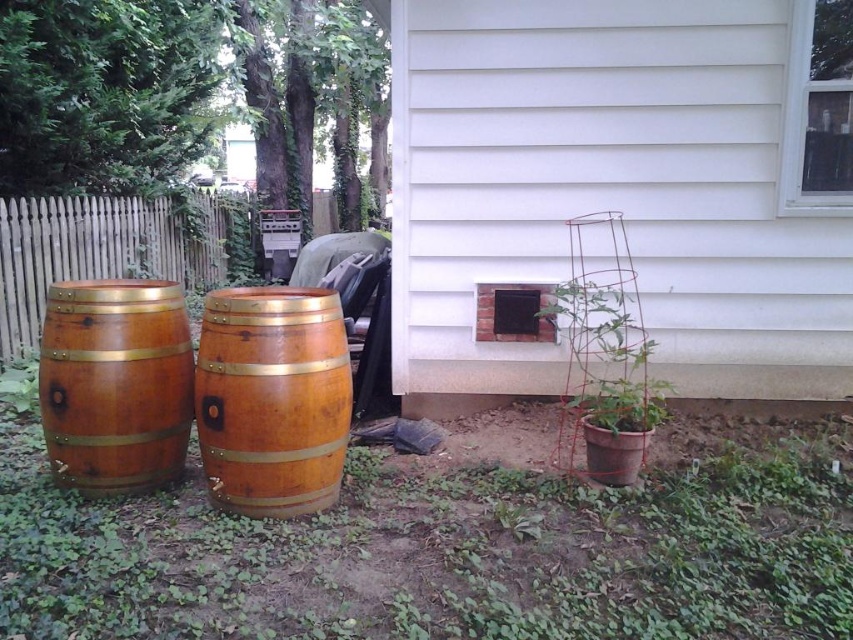
Consider the image. Does wooden barrel at left have a greater width compared to brown wooden fence at left?

No, wooden barrel at left is not wider than brown wooden fence at left.

Is wooden barrel at left shorter than brown wooden fence at left?

Yes, wooden barrel at left is shorter than brown wooden fence at left.

Is point (70, 300) less distant than point (112, 196)?

Yes, it is.

At what (x,y) coordinates should I click in order to perform the action: click on wooden barrel at left. Please return your answer as a coordinate pair (x, y). Looking at the image, I should click on (115, 384).

Who is higher up, wooden barrel at left or green mesh trellis at lower right?

wooden barrel at left is above.

Can you confirm if wooden barrel at left is taller than green mesh trellis at lower right?

Correct, wooden barrel at left is much taller as green mesh trellis at lower right.

Is point (137, 456) positioned in front of point (614, 342)?

Yes, it is in front of point (614, 342).

At what (x,y) coordinates should I click in order to perform the action: click on wooden barrel at left. Please return your answer as a coordinate pair (x, y). Looking at the image, I should click on (115, 384).

Between wooden barrel at center and wooden barrel at left, which one appears on the left side from the viewer's perspective?

wooden barrel at left

Between wooden barrel at center and wooden barrel at left, which one has more height?

With more height is wooden barrel at center.

Describe the element at coordinates (271, 397) in the screenshot. I see `wooden barrel at center` at that location.

Where is `wooden barrel at center`? Image resolution: width=853 pixels, height=640 pixels. wooden barrel at center is located at coordinates (271, 397).